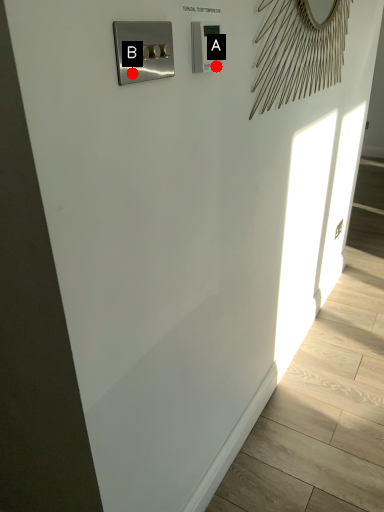
Question: Two points are circled on the image, labeled by A and B beside each circle. Which point is closer to the camera?

Choices:
 (A) A is closer
 (B) B is closer

Answer: (B)